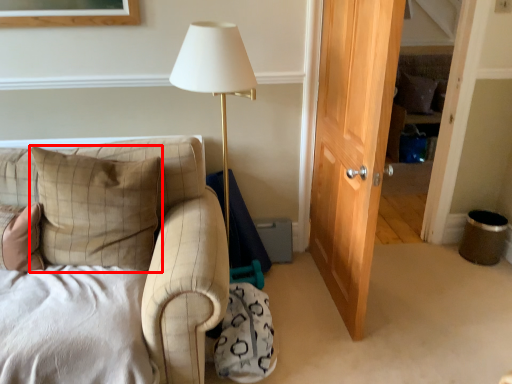
Question: From the image's perspective, what is the correct spatial relationship of pillow (annotated by the red box) in relation to pillow?

Choices:
 (A) above
 (B) below

Answer: (B)